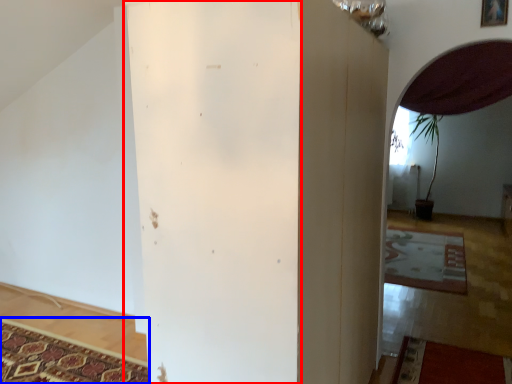
Question: Which of the following is the closest to the observer, pillar (highlighted by a red box) or mat (highlighted by a blue box)?

Choices:
 (A) pillar
 (B) mat

Answer: (A)